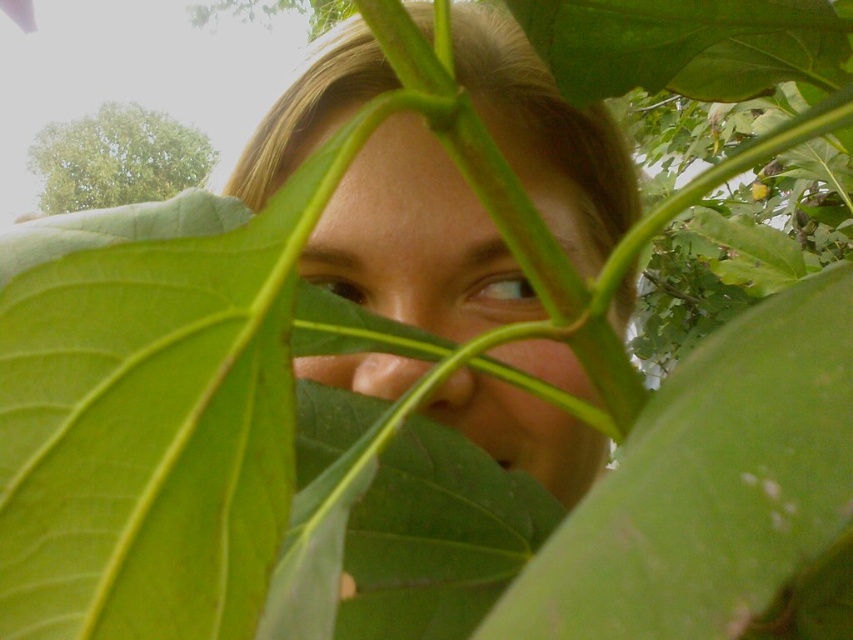
You are a photographer trying to capture a portrait of the person in the image. The green matte leaf at center and the brown glossy eye at center are in your viewfinder. Which object should you move your camera to focus on to ensure the subject is fully visible?

The green matte leaf at center is bigger than the brown glossy eye at center, so focusing on the brown glossy eye at center would allow the subject to be fully visible without obstruction from the larger leaf.

You are a photographer trying to capture a clear shot of the light brown eye at upper center without the green matte leaf at upper center blocking it. Based on their positions, can you adjust your camera angle to the left to achieve this?

The green matte leaf at upper center is to the right of the light brown eye at upper center. By adjusting the camera angle to the left, you can move the leaf out of the frame, allowing a clear view of the light brown eye at upper center.

You need to determine which leaf is closer to the camera between the green matte leaf at center and the green matte leaf at upper center. Which one is closer?

The green matte leaf at center is much taller than the green matte leaf at upper center, so it is closer to the camera.